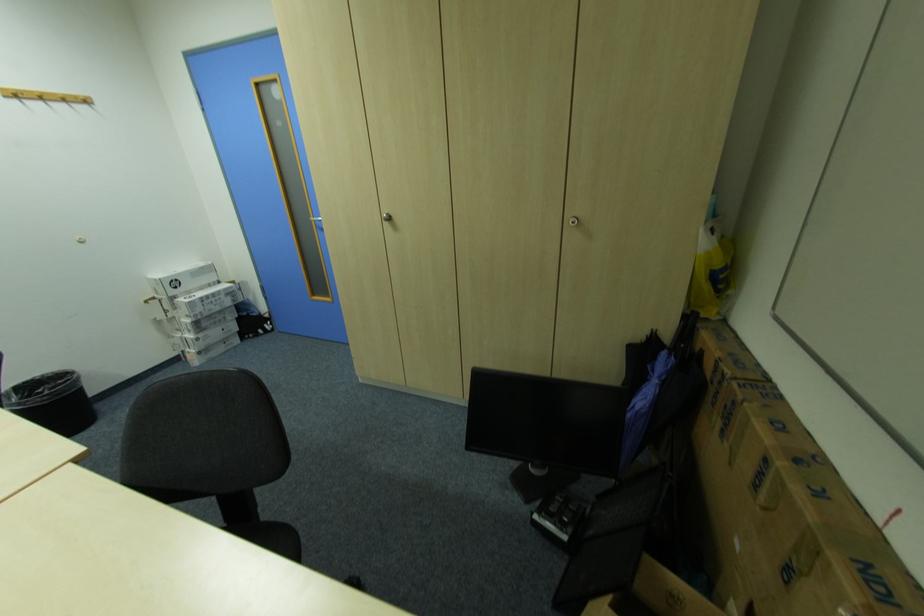
Find the location of a particular element. Image resolution: width=924 pixels, height=616 pixels. white cardboard box is located at coordinates [787, 520].